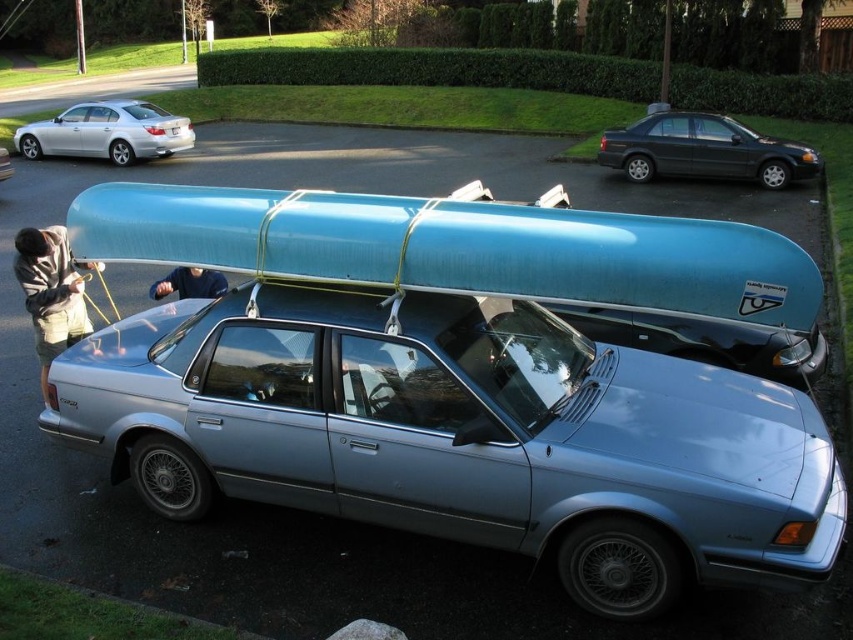
Does matte black sedan at upper right appear on the left side of khaki shorts at lower left?

In fact, matte black sedan at upper right is to the right of khaki shorts at lower left.

In the scene shown: Can you confirm if matte black sedan at upper right is positioned below khaki shorts at lower left?

Incorrect, matte black sedan at upper right is not positioned below khaki shorts at lower left.

Which is behind, point (799, 177) or point (57, 253)?

The point (799, 177) is more distant.

Where is `matte black sedan at upper right`? The image size is (853, 640). matte black sedan at upper right is located at coordinates (703, 150).

Which is behind, point (54, 237) or point (177, 266)?

The point (54, 237) is behind.

Can you confirm if khaki shorts at lower left is bigger than dark blue shirt at upper center?

Yes.

Does point (73, 305) lie behind point (218, 292)?

No.

You are a GUI agent. You are given a task and a screenshot of the screen. Output one action in this format:
    pyautogui.click(x=<x>, y=<y>)
    Task: Click on the khaki shorts at lower left
    
    Given the screenshot: What is the action you would take?
    pyautogui.click(x=51, y=292)

Between matte black sedan at upper right and silver metallic sedan at upper left, which one has more height?

Standing taller between the two is silver metallic sedan at upper left.

Who is shorter, matte black sedan at upper right or silver metallic sedan at upper left?

matte black sedan at upper right

Does point (654, 176) lie behind point (180, 145)?

That is False.

Identify the location of matte black sedan at upper right. (703, 150).